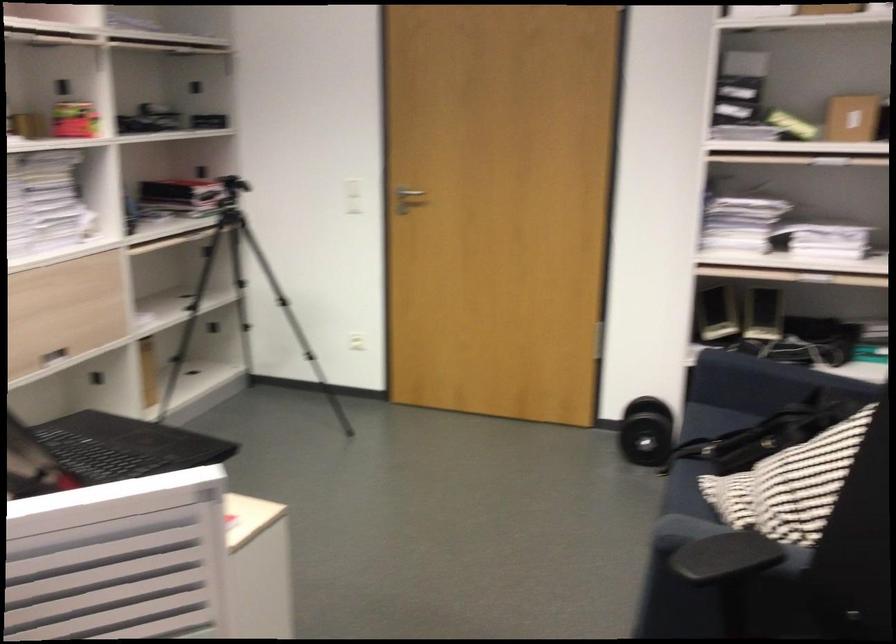
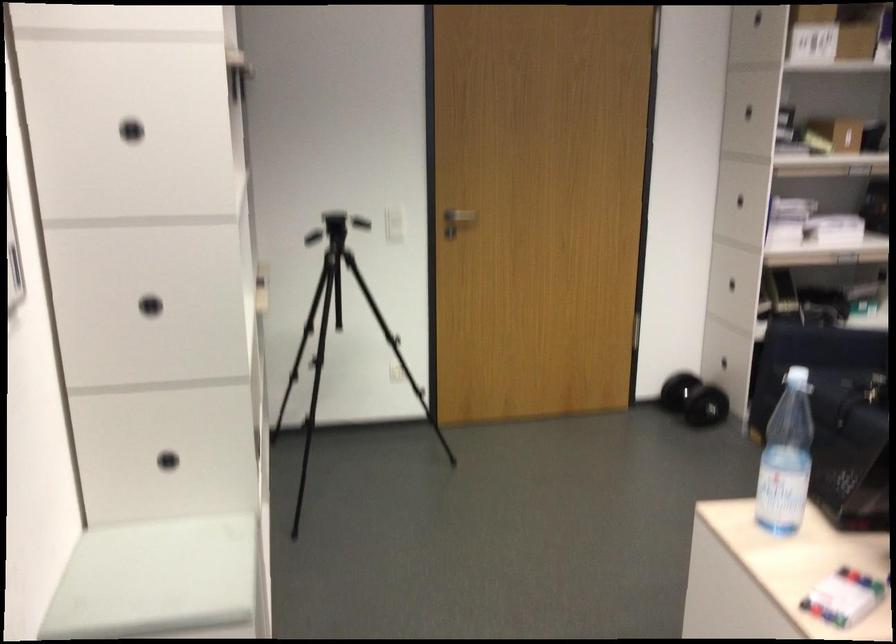
Locate, in the second image, the point that corresponds to (330,297) in the first image.

(339, 334)